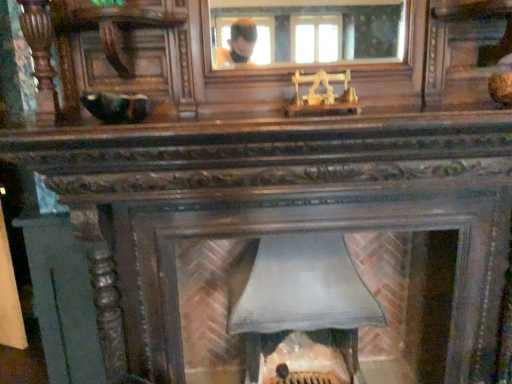
What do you see at coordinates (307, 31) in the screenshot?
I see `clear glass mirror at upper center` at bounding box center [307, 31].

In order to face clear glass mirror at upper center, should I rotate leftwards or rightwards?

Rotate right and turn 7.053 degrees.

What is the approximate width of clear glass mirror at upper center?

It is 7.15 centimeters.

At what (x,y) coordinates should I click in order to perform the action: click on clear glass mirror at upper center. Please return your answer as a coordinate pair (x, y). The image size is (512, 384). Looking at the image, I should click on (307, 31).

Identify the location of smooth gray stone fireplace at center. This screenshot has width=512, height=384. click(409, 297).

Measure the distance between smooth gray stone fireplace at center and camera.

smooth gray stone fireplace at center is 5.05 feet away from camera.

The height and width of the screenshot is (384, 512). Describe the element at coordinates (409, 297) in the screenshot. I see `smooth gray stone fireplace at center` at that location.

From the picture: What is the approximate width of smooth gray stone fireplace at center?

smooth gray stone fireplace at center is 16.42 inches wide.

You are a GUI agent. You are given a task and a screenshot of the screen. Output one action in this format:
    pyautogui.click(x=<x>, y=<y>)
    Task: Click on the clear glass mirror at upper center
    The image size is (512, 384).
    Given the screenshot: What is the action you would take?
    pyautogui.click(x=307, y=31)

In the image, is smooth gray stone fireplace at center on the left side or the right side of clear glass mirror at upper center?

smooth gray stone fireplace at center is to the right of clear glass mirror at upper center.

Considering the positions of objects smooth gray stone fireplace at center and clear glass mirror at upper center in the image provided, who is in front, smooth gray stone fireplace at center or clear glass mirror at upper center?

clear glass mirror at upper center.

Does point (380, 246) come farther from viewer compared to point (369, 21)?

That is False.

From the image's perspective, which one is positioned higher, smooth gray stone fireplace at center or clear glass mirror at upper center?

clear glass mirror at upper center, from the image's perspective.

From a real-world perspective, between smooth gray stone fireplace at center and clear glass mirror at upper center, who is vertically lower?

smooth gray stone fireplace at center.

Between smooth gray stone fireplace at center and clear glass mirror at upper center, which one has smaller width?

clear glass mirror at upper center.

From their relative heights in the image, would you say smooth gray stone fireplace at center is taller or shorter than clear glass mirror at upper center?

In the image, smooth gray stone fireplace at center appears to be taller than clear glass mirror at upper center.

Which of these two, smooth gray stone fireplace at center or clear glass mirror at upper center, is bigger?

Bigger between the two is smooth gray stone fireplace at center.

Is smooth gray stone fireplace at center positioned beyond the bounds of clear glass mirror at upper center?

Yes, smooth gray stone fireplace at center is outside of clear glass mirror at upper center.

Is smooth gray stone fireplace at center placed right next to clear glass mirror at upper center?

There is a gap between smooth gray stone fireplace at center and clear glass mirror at upper center.

Is smooth gray stone fireplace at center looking in the opposite direction of clear glass mirror at upper center?

smooth gray stone fireplace at center is not turned away from clear glass mirror at upper center.

How different are the orientations of smooth gray stone fireplace at center and clear glass mirror at upper center in degrees?

They differ by 2.65 degrees in their facing directions.

Where is `mirror above the smooth gray stone fireplace at center (from a real-world perspective)`? mirror above the smooth gray stone fireplace at center (from a real-world perspective) is located at coordinates (307, 31).

Between clear glass mirror at upper center and smooth gray stone fireplace at center, which one appears on the right side from the viewer's perspective?

From the viewer's perspective, smooth gray stone fireplace at center appears more on the right side.

Does clear glass mirror at upper center lie in front of smooth gray stone fireplace at center?

That is True.

Which is further, (242, 0) or (218, 360)?

The point (218, 360) is farther from the camera.

From the image's perspective, is clear glass mirror at upper center located beneath smooth gray stone fireplace at center?

No, from the image's perspective, clear glass mirror at upper center is not beneath smooth gray stone fireplace at center.

From a real-world perspective, is clear glass mirror at upper center on smooth gray stone fireplace at center?

Yes, from a real-world perspective, clear glass mirror at upper center is on top of smooth gray stone fireplace at center.

Considering the sizes of objects clear glass mirror at upper center and smooth gray stone fireplace at center in the image provided, who is wider, clear glass mirror at upper center or smooth gray stone fireplace at center?

Wider between the two is smooth gray stone fireplace at center.

Is clear glass mirror at upper center taller than smooth gray stone fireplace at center?

No, clear glass mirror at upper center is not taller than smooth gray stone fireplace at center.

Considering the relative sizes of clear glass mirror at upper center and smooth gray stone fireplace at center in the image provided, is clear glass mirror at upper center bigger than smooth gray stone fireplace at center?

No, clear glass mirror at upper center is not bigger than smooth gray stone fireplace at center.

Could smooth gray stone fireplace at center be considered to be inside clear glass mirror at upper center?

No, clear glass mirror at upper center does not contain smooth gray stone fireplace at center.

Is clear glass mirror at upper center placed right next to smooth gray stone fireplace at center?

clear glass mirror at upper center and smooth gray stone fireplace at center are not in contact.

Is clear glass mirror at upper center positioned with its back to smooth gray stone fireplace at center?

No.

You are a GUI agent. You are given a task and a screenshot of the screen. Output one action in this format:
    pyautogui.click(x=<x>, y=<y>)
    Task: Click on the fireplace below the clear glass mirror at upper center (from the image's perspective)
    
    Given the screenshot: What is the action you would take?
    pyautogui.click(x=409, y=297)

Locate an element on the screen. This screenshot has width=512, height=384. fireplace behind the clear glass mirror at upper center is located at coordinates (409, 297).

At what (x,y) coordinates should I click in order to perform the action: click on mirror that appears above the smooth gray stone fireplace at center (from a real-world perspective). Please return your answer as a coordinate pair (x, y). Looking at the image, I should click on (307, 31).